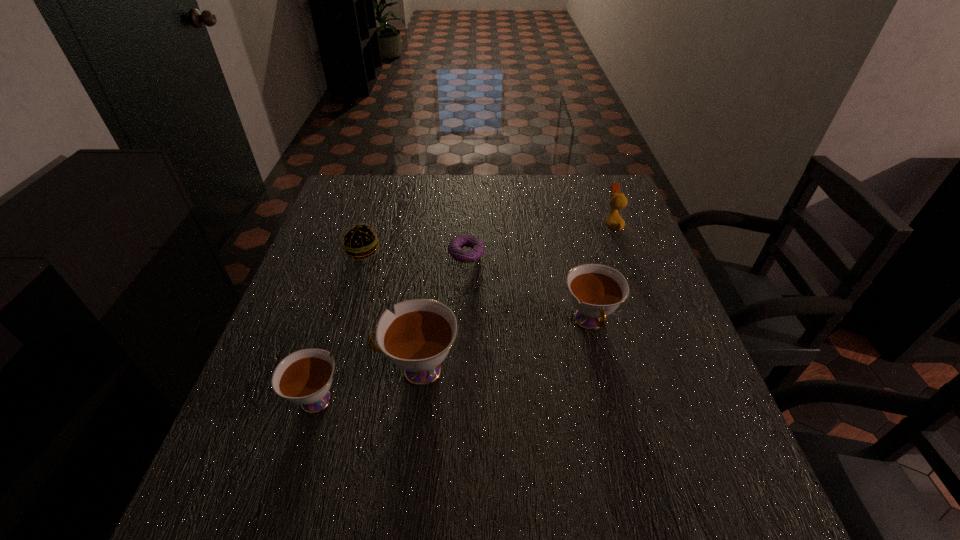
Find the location of a particular element. vacant space in between the doughnut and the rightmost object is located at coordinates (540, 240).

Locate an element on the screen. This screenshot has width=960, height=540. object that stands as the second closest to the fifth object from left to right is located at coordinates (417, 339).

At what (x,y) coordinates should I click in order to perform the action: click on object that stands as the closest to the leftmost teacup. Please return your answer as a coordinate pair (x, y). Looking at the image, I should click on (417, 339).

Where is `the closest teacup to the patty`? the closest teacup to the patty is located at coordinates 417,339.

Identify which teacup is located as the second nearest to the farthest object. Please provide its 2D coordinates. Your answer should be formatted as a tuple, i.e. [(x, y)], where the tuple contains the x and y coordinates of a point satisfying the conditions above.

[(417, 339)]

You are a GUI agent. You are given a task and a screenshot of the screen. Output one action in this format:
    pyautogui.click(x=<x>, y=<y>)
    Task: Click on the free location that satisfies the following two spatial constraints: 1. on the side of the rightmost teacup with the handle; 2. on the side of the second teacup from left to right with the handle
    
    Given the screenshot: What is the action you would take?
    pyautogui.click(x=601, y=369)

At what (x,y) coordinates should I click in order to perform the action: click on vacant space that satisfies the following two spatial constraints: 1. on the side of the leftmost teacup with the handle; 2. on the right side of the doughnut. Please return your answer as a coordinate pair (x, y). Looking at the image, I should click on (361, 254).